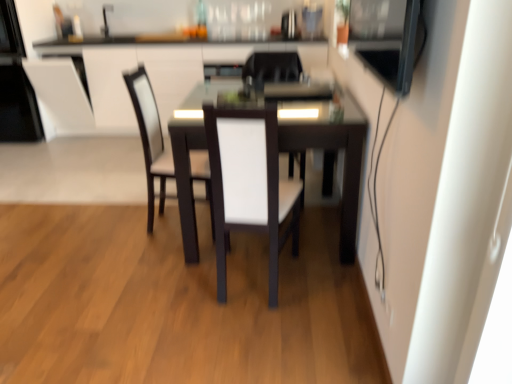
What is the approximate height of dark wood table at center?

dark wood table at center is 30.69 inches tall.

The image size is (512, 384). Identify the location of matte black table at center. (167, 72).

What is the approximate height of white leather chair at center, which ranks as the 2th chair in front-to-back order?

It is 36.55 inches.

I want to click on white fabric chair at center, which is the 3th chair from back to front, so click(249, 184).

Describe the element at coordinates (249, 184) in the screenshot. I see `white fabric chair at center, marked as the first chair in a front-to-back arrangement` at that location.

At what (x,y) coordinates should I click in order to perform the action: click on white fabric chair at center, the third chair in the front-to-back sequence. Please return your answer as a coordinate pair (x, y). This screenshot has height=384, width=512. Looking at the image, I should click on (271, 70).

Locate an element on the screen. The image size is (512, 384). dark wood table at center is located at coordinates (330, 152).

Which is correct: satin black refrigerator at upper center, which ranks as the 2th appliance in right-to-left order, is inside matte black table at center, or outside of it?

satin black refrigerator at upper center, which ranks as the 2th appliance in right-to-left order, exists outside the volume of matte black table at center.

Is satin black refrigerator at upper center, which ranks as the 2th appliance in right-to-left order, oriented away from matte black table at center?

No, satin black refrigerator at upper center, which ranks as the 2th appliance in right-to-left order,'s orientation is not away from matte black table at center.

Is satin black refrigerator at upper center, positioned as the 2th appliance in left-to-right order, in contact with matte black table at center?

No, satin black refrigerator at upper center, positioned as the 2th appliance in left-to-right order, is not in contact with matte black table at center.

How different are the orientations of satin black refrigerator at upper center, arranged as the first appliance when viewed from the back, and matte black table at center in degrees?

The facing directions of satin black refrigerator at upper center, arranged as the first appliance when viewed from the back, and matte black table at center are 0.811 degrees apart.

How distant is matte black table at center from white fabric chair at center, marked as the 1th chair in a back-to-front arrangement?

4.10 feet.

Considering the points (167, 84) and (304, 177), which point is behind, point (167, 84) or point (304, 177)?

The point (167, 84) is farther.

Which of these two, matte black table at center or white fabric chair at center, the third chair in the front-to-back sequence, is thinner?

white fabric chair at center, the third chair in the front-to-back sequence, is thinner.

Which is more to the left, matte black table at center or white fabric chair at center, marked as the 1th chair in a back-to-front arrangement?

matte black table at center.

Considering the positions of point (304, 134) and point (302, 73), is point (304, 134) closer or farther from the camera than point (302, 73)?

Point (304, 134) appears to be closer to the viewer than point (302, 73).

Is dark wood table at center inside or outside of white fabric chair at center, marked as the 1th chair in a back-to-front arrangement?

The correct answer is: outside.

In the scene shown: In terms of width, does dark wood table at center look wider or thinner when compared to white fabric chair at center, the third chair in the front-to-back sequence?

In the image, dark wood table at center appears to be wider than white fabric chair at center, the third chair in the front-to-back sequence.

Which object is thinner, metallic stainless steel microwave at upper right, which is the third appliance from back to front, or white leather chair at center, which is the second chair in back-to-front order?

metallic stainless steel microwave at upper right, which is the third appliance from back to front.

Is metallic stainless steel microwave at upper right, positioned as the 3th appliance in left-to-right order, taller or shorter than white leather chair at center, which is the second chair in back-to-front order?

Clearly, metallic stainless steel microwave at upper right, positioned as the 3th appliance in left-to-right order, is shorter compared to white leather chair at center, which is the second chair in back-to-front order.

Between metallic stainless steel microwave at upper right, positioned as the 3th appliance in left-to-right order, and white leather chair at center, which ranks as the 2th chair in front-to-back order, which one has smaller size?

Smaller between the two is metallic stainless steel microwave at upper right, positioned as the 3th appliance in left-to-right order.

From the image's perspective, is metallic stainless steel microwave at upper right, which is the third appliance from back to front, beneath white leather chair at center, which is the second chair in back-to-front order?

Actually, metallic stainless steel microwave at upper right, which is the third appliance from back to front, appears above white leather chair at center, which is the second chair in back-to-front order, in the image.

Are metallic stainless steel microwave at upper right, placed as the first appliance when sorted from right to left, and white fabric chair at center, marked as the first chair in a front-to-back arrangement, far apart?

They are positioned close to each other.

Does metallic stainless steel microwave at upper right, placed as the first appliance when sorted from right to left, appear on the right side of white fabric chair at center, which is the 3th chair from back to front?

Yes.

Which is closer to the camera, (360, 59) or (216, 170)?

Positioned in front is point (360, 59).

Would you say satin black refrigerator at upper center, the 3th appliance in the front-to-back sequence, is inside or outside white fabric chair at center, the third chair in the front-to-back sequence?

satin black refrigerator at upper center, the 3th appliance in the front-to-back sequence, cannot be found inside white fabric chair at center, the third chair in the front-to-back sequence.

From the image's perspective, relative to white fabric chair at center, the third chair in the front-to-back sequence, is satin black refrigerator at upper center, the 3th appliance in the front-to-back sequence, above or below?

From the image's perspective, satin black refrigerator at upper center, the 3th appliance in the front-to-back sequence, appears above white fabric chair at center, the third chair in the front-to-back sequence.

Looking at this image, considering the relative sizes of satin black refrigerator at upper center, which ranks as the 2th appliance in right-to-left order, and white fabric chair at center, marked as the 1th chair in a back-to-front arrangement, in the image provided, is satin black refrigerator at upper center, which ranks as the 2th appliance in right-to-left order, shorter than white fabric chair at center, marked as the 1th chair in a back-to-front arrangement,?

Yes.

Does white fabric chair at center, the third chair in the front-to-back sequence, have a greater height compared to dark wood table at center?

In fact, white fabric chair at center, the third chair in the front-to-back sequence, may be shorter than dark wood table at center.

Relative to dark wood table at center, is white fabric chair at center, the third chair in the front-to-back sequence, in front or behind?

Visually, white fabric chair at center, the third chair in the front-to-back sequence, is located behind dark wood table at center.

Is point (279, 80) positioned before point (170, 122)?

No.

Considering the sizes of white fabric chair at center, marked as the 1th chair in a back-to-front arrangement, and dark wood table at center in the image, is white fabric chair at center, marked as the 1th chair in a back-to-front arrangement, wider or thinner than dark wood table at center?

Considering their sizes, white fabric chair at center, marked as the 1th chair in a back-to-front arrangement, looks slimmer than dark wood table at center.

From a real-world perspective, count 2nd appliances upward from the matte black table at center and point to it. Please provide its 2D coordinates.

[(289, 25)]

Locate an element on the screen. This screenshot has height=384, width=512. chair that is the 1st one when counting downward from the matte black table at center (from the image's perspective) is located at coordinates pyautogui.click(x=271, y=70).

Looking at the image, which one is located closer to dark wood table at center, matte black table at center or white leather chair at center, which ranks as the 2th chair in front-to-back order?

The object closer to dark wood table at center is white leather chair at center, which ranks as the 2th chair in front-to-back order.

Looking at the image, which one is located closer to dark wood table at center, satin black refrigerator at upper center, the 3th appliance in the front-to-back sequence, or white fabric chair at center, marked as the 1th chair in a back-to-front arrangement?

white fabric chair at center, marked as the 1th chair in a back-to-front arrangement, is closer to dark wood table at center.

In the scene shown: Based on their spatial positions, is white leather chair at center, which is the second chair in back-to-front order, or black glossy microwave at upper left, placed as the 2th appliance when sorted from back to front, further from matte black table at center?

Based on the image, white leather chair at center, which is the second chair in back-to-front order, appears to be further to matte black table at center.

From the image, which object appears to be nearer to black glossy microwave at upper left, marked as the 3th appliance in a right-to-left arrangement, white leather armchair at upper left or satin black refrigerator at upper center, arranged as the first appliance when viewed from the back?

Based on the image, white leather armchair at upper left appears to be nearer to black glossy microwave at upper left, marked as the 3th appliance in a right-to-left arrangement.

Estimate the real-world distances between objects in this image. Which object is further from white leather chair at center, which ranks as the 2th chair in front-to-back order, black glossy microwave at upper left, marked as the 1th appliance in a left-to-right arrangement, or white leather armchair at upper left?

Based on the image, black glossy microwave at upper left, marked as the 1th appliance in a left-to-right arrangement, appears to be further to white leather chair at center, which ranks as the 2th chair in front-to-back order.

Based on their spatial positions, is matte black table at center or white leather armchair at upper left closer to black glossy microwave at upper left, placed as the 2th appliance when sorted from back to front?

white leather armchair at upper left is positioned closer to the anchor black glossy microwave at upper left, placed as the 2th appliance when sorted from back to front.

Estimate the real-world distances between objects in this image. Which object is closer to white fabric chair at center, which is the 3th chair from back to front, black glossy microwave at upper left, marked as the 1th appliance in a left-to-right arrangement, or white fabric chair at center, the third chair in the front-to-back sequence?

white fabric chair at center, the third chair in the front-to-back sequence, is closer to white fabric chair at center, which is the 3th chair from back to front.

Looking at the image, which one is located closer to black glossy microwave at upper left, marked as the 1th appliance in a left-to-right arrangement, white fabric chair at center, which is the 3th chair from back to front, or white leather armchair at upper left?

white leather armchair at upper left lies closer to black glossy microwave at upper left, marked as the 1th appliance in a left-to-right arrangement, than the other object.

Where is `computer desk between black glossy microwave at upper left, marked as the 1th appliance in a left-to-right arrangement, and white leather chair at center, which is the second chair in back-to-front order, in the horizontal direction`? computer desk between black glossy microwave at upper left, marked as the 1th appliance in a left-to-right arrangement, and white leather chair at center, which is the second chair in back-to-front order, in the horizontal direction is located at coordinates (167, 72).

This screenshot has width=512, height=384. Identify the location of table between white fabric chair at center, which is the 3th chair from back to front, and matte black table at center from front to back. (330, 152).

Where is `armchair between black glossy microwave at upper left, marked as the 3th appliance in a right-to-left arrangement, and white leather chair at center, which is the second chair in back-to-front order, from left to right`? armchair between black glossy microwave at upper left, marked as the 3th appliance in a right-to-left arrangement, and white leather chair at center, which is the second chair in back-to-front order, from left to right is located at coordinates (60, 97).

Find the location of a particular element. table between white fabric chair at center, marked as the first chair in a front-to-back arrangement, and white fabric chair at center, marked as the 1th chair in a back-to-front arrangement, from front to back is located at coordinates (330, 152).